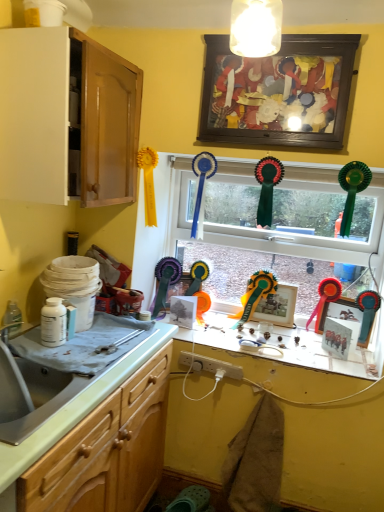
Question: Which direction should I rotate to look at matte paper picture frame at center, which ranks as the 3th picture frame in top-to-bottom order?

Choices:
 (A) left
 (B) right

Answer: (A)

Question: Is metallic gold picture frame at center, the fourth picture frame positioned from the bottom, touching light wood cabinet at left, the 2th cabinetry from the top?

Choices:
 (A) no
 (B) yes

Answer: (A)

Question: From the image's perspective, is metallic gold picture frame at center, the 2th picture frame from the top, on light wood cabinet at left, which is the first cabinetry from bottom to top?

Choices:
 (A) no
 (B) yes

Answer: (B)

Question: From a real-world perspective, does metallic gold picture frame at center, the fourth picture frame positioned from the bottom, sit lower than light wood cabinet at left, the 2th cabinetry from the top?

Choices:
 (A) yes
 (B) no

Answer: (B)

Question: Is metallic gold picture frame at center, the fourth picture frame positioned from the bottom, shorter than light wood cabinet at left, the 2th cabinetry from the top?

Choices:
 (A) yes
 (B) no

Answer: (B)

Question: Is metallic gold picture frame at center, the fourth picture frame positioned from the bottom, at the right side of light wood cabinet at left, the 2th cabinetry from the top?

Choices:
 (A) no
 (B) yes

Answer: (B)

Question: Does metallic gold picture frame at center, the fourth picture frame positioned from the bottom, appear on the left side of light wood cabinet at left, which is the first cabinetry from bottom to top?

Choices:
 (A) yes
 (B) no

Answer: (B)

Question: From the image's perspective, would you say light wood cabinet at left, which is the first cabinetry from bottom to top, is shown under metallic silver picture frame at right, the 4th picture frame when ordered from top to bottom?

Choices:
 (A) yes
 (B) no

Answer: (A)

Question: Can you confirm if light wood cabinet at left, which is the first cabinetry from bottom to top, is positioned to the right of metallic silver picture frame at right, the 4th picture frame when ordered from top to bottom?

Choices:
 (A) yes
 (B) no

Answer: (B)

Question: Can you confirm if light wood cabinet at left, which is the first cabinetry from bottom to top, is wider than metallic silver picture frame at right, the 4th picture frame when ordered from top to bottom?

Choices:
 (A) no
 (B) yes

Answer: (B)

Question: From the image's perspective, does light wood cabinet at left, the 2th cabinetry from the top, appear higher than metallic silver picture frame at right, which is the second picture frame in bottom-to-top order?

Choices:
 (A) no
 (B) yes

Answer: (A)

Question: Considering the relative sizes of light wood cabinet at left, the 2th cabinetry from the top, and metallic silver picture frame at right, the 4th picture frame when ordered from top to bottom, in the image provided, is light wood cabinet at left, the 2th cabinetry from the top, thinner than metallic silver picture frame at right, the 4th picture frame when ordered from top to bottom,?

Choices:
 (A) yes
 (B) no

Answer: (B)

Question: Is light wood cabinet at left, the 2th cabinetry from the top, outside metallic silver picture frame at right, the 4th picture frame when ordered from top to bottom?

Choices:
 (A) no
 (B) yes

Answer: (B)

Question: Does metallic silver picture frame at right, which is the second picture frame in bottom-to-top order, contain wooden picture frame at upper center, which ranks as the first picture frame in top-to-bottom order?

Choices:
 (A) no
 (B) yes

Answer: (A)